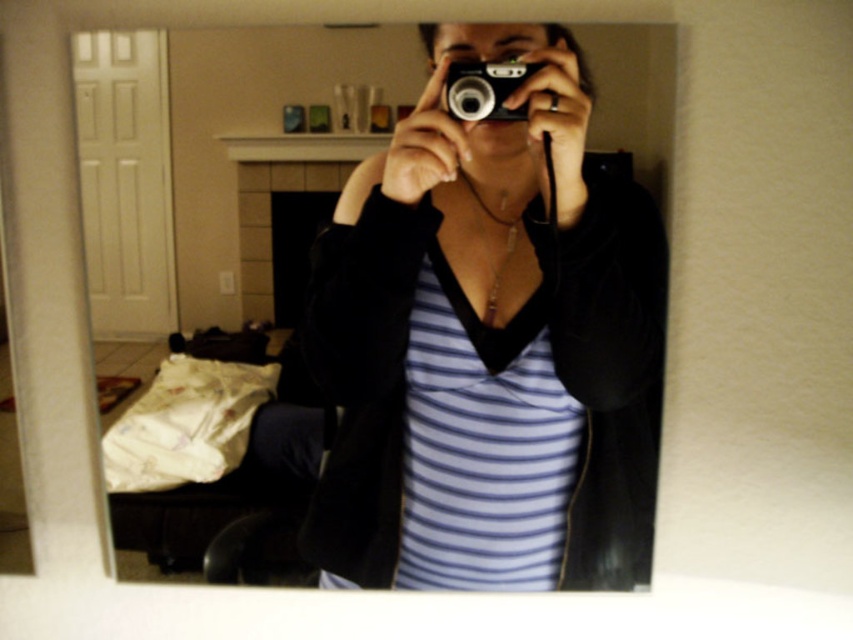
From the picture: You are standing in the living room and want to reach both the point at coordinates point (440, 412) and point (485, 67). Which point should you approach first if you want to reach the one closer to you?

You should approach point (485, 67) first because it is closer to you than point (440, 412), which is further away.

You are setting up a photography display and need to arrange the matte black camera at center and the silver metallic camera at center based on their positions in the mirror selfie. Which camera should you place higher on the display to match their original arrangement?

The silver metallic camera at center should be placed higher on the display because in the original image, the matte black camera at center is located below the silver metallic camera at center.